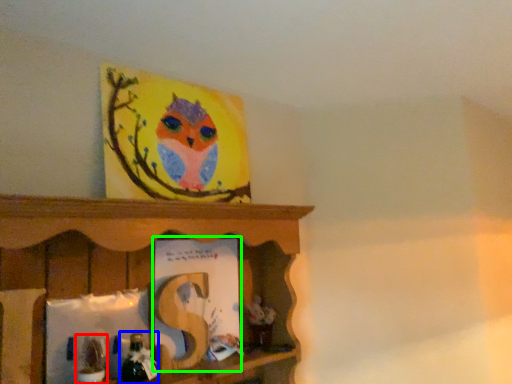
Question: Estimate the real-world distances between objects in this image. Which object is closer to toy (highlighted by a red box), toy (highlighted by a blue box) or book (highlighted by a green box)?

Choices:
 (A) toy
 (B) book

Answer: (A)